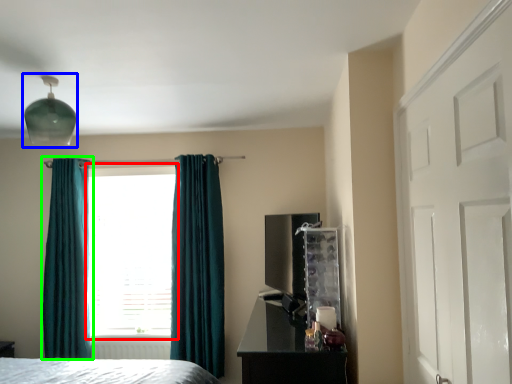
Question: Estimate the real-world distances between objects in this image. Which object is farther from window (highlighted by a red box), light fixture (highlighted by a blue box) or curtain (highlighted by a green box)?

Choices:
 (A) light fixture
 (B) curtain

Answer: (A)